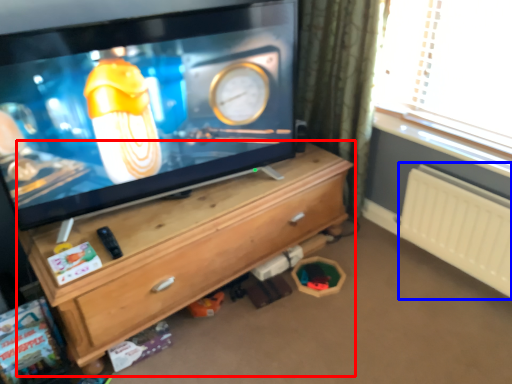
Question: Which object is closer to the camera taking this photo, chest of drawers (highlighted by a red box) or radiator (highlighted by a blue box)?

Choices:
 (A) chest of drawers
 (B) radiator

Answer: (A)